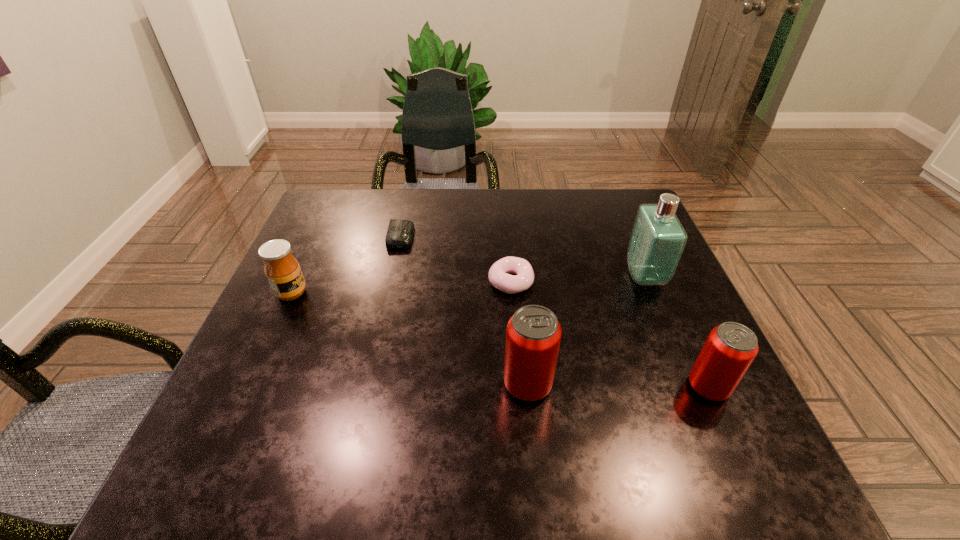
Identify the location of the taller can. (533, 336).

Locate an element on the screen. The height and width of the screenshot is (540, 960). the second tallest object is located at coordinates point(533,336).

Where is `the right can`? the right can is located at coordinates (731, 347).

At what (x,y) coordinates should I click in order to perform the action: click on alarm clock. Please return your answer as a coordinate pair (x, y). Looking at the image, I should click on click(x=399, y=235).

At what (x,y) coordinates should I click in order to perform the action: click on the second object from left to right. Please return your answer as a coordinate pair (x, y). This screenshot has height=540, width=960. Looking at the image, I should click on (399, 235).

You are a GUI agent. You are given a task and a screenshot of the screen. Output one action in this format:
    pyautogui.click(x=<x>, y=<y>)
    Task: Click on the tallest object
    Image resolution: width=960 pixels, height=540 pixels.
    Given the screenshot: What is the action you would take?
    pyautogui.click(x=657, y=241)

At what (x,y) coordinates should I click in order to perform the action: click on doughnut. Please return your answer as a coordinate pair (x, y). The height and width of the screenshot is (540, 960). Looking at the image, I should click on (498, 276).

The height and width of the screenshot is (540, 960). Find the location of `the leftmost object`. the leftmost object is located at coordinates (282, 270).

In order to click on vacant space situated 0.200m on the back of the left can in this screenshot , I will do `click(519, 295)`.

Find the location of a particular element. free spot located on the back of the right can is located at coordinates (650, 258).